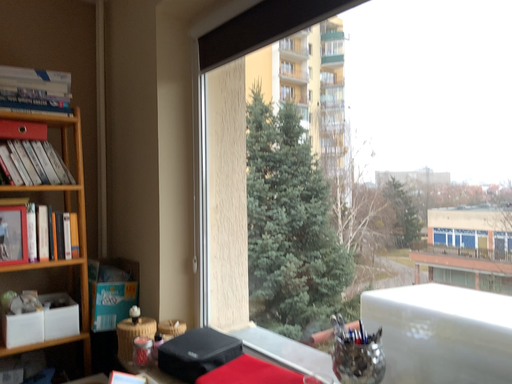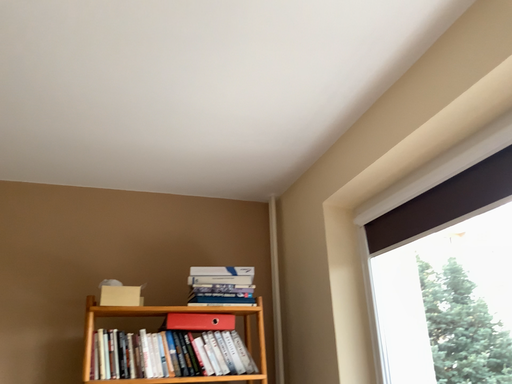
Question: Which way did the camera rotate in the video?

Choices:
 (A) rotated downward
 (B) rotated upward

Answer: (B)